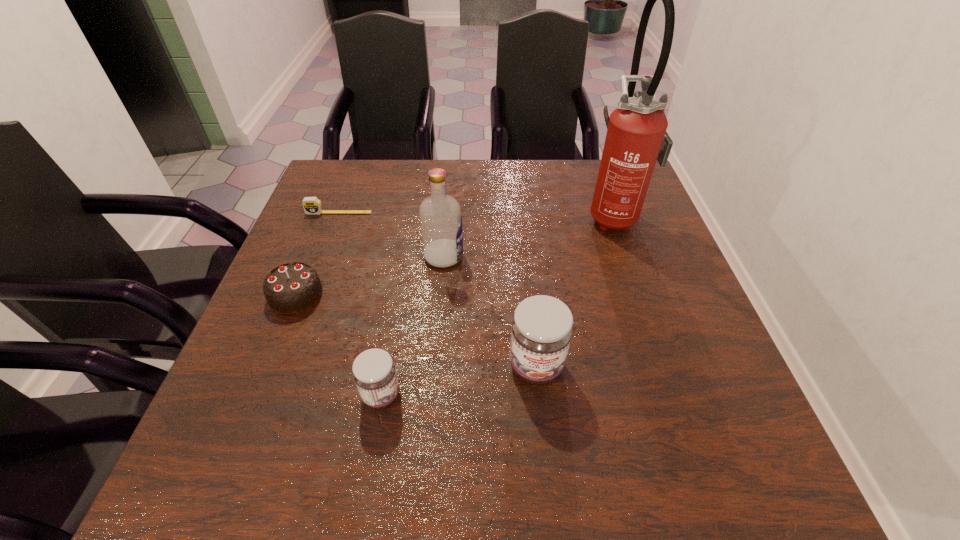
This screenshot has width=960, height=540. I want to click on chocolate cake that is at the left edge, so click(291, 288).

This screenshot has height=540, width=960. I want to click on object at the right edge, so click(636, 138).

Locate an element on the screen. The image size is (960, 540). object present at the far right corner is located at coordinates (636, 138).

Locate an element on the screen. The width and height of the screenshot is (960, 540). vacant area at the far edge is located at coordinates (449, 160).

This screenshot has height=540, width=960. In order to click on blank space at the near edge of the desktop in this screenshot , I will do `click(442, 392)`.

Where is `free space at the left edge`? This screenshot has width=960, height=540. free space at the left edge is located at coordinates (275, 378).

The image size is (960, 540). In the image, there is a desktop. Identify the location of vacant area at the right edge. (654, 255).

You are a GUI agent. You are given a task and a screenshot of the screen. Output one action in this format:
    pyautogui.click(x=<x>, y=<y>)
    Task: Click on the vacant space at the far left corner of the desktop
    Image resolution: width=960 pixels, height=540 pixels.
    Given the screenshot: What is the action you would take?
    pyautogui.click(x=341, y=183)

You are a GUI agent. You are given a task and a screenshot of the screen. Output one action in this format:
    pyautogui.click(x=<x>, y=<y>)
    Task: Click on the vacant area at the near right corner of the desktop
    
    Given the screenshot: What is the action you would take?
    pyautogui.click(x=695, y=390)

Where is `vacant space in between the fourth object from right to left and the tallest object`? This screenshot has width=960, height=540. vacant space in between the fourth object from right to left and the tallest object is located at coordinates (498, 306).